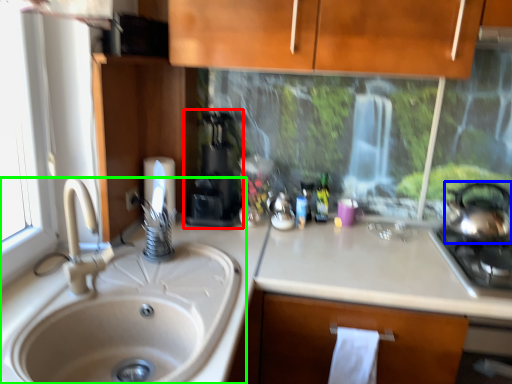
Question: Considering the real-world distances, which object is farthest from coffee machine (highlighted by a red box)? tea pot (highlighted by a blue box) or sink (highlighted by a green box)?

Choices:
 (A) tea pot
 (B) sink

Answer: (A)